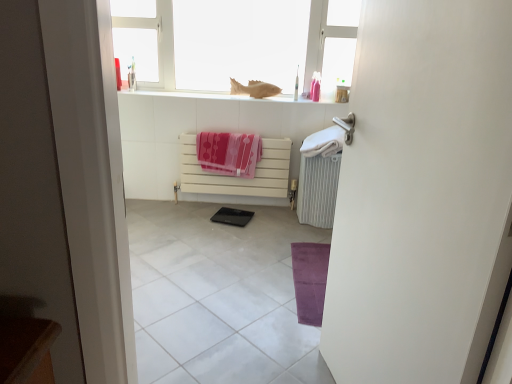
Locate an element on the screen. The height and width of the screenshot is (384, 512). free location above white glossy tile at center (from a real-world perspective) is located at coordinates (200, 282).